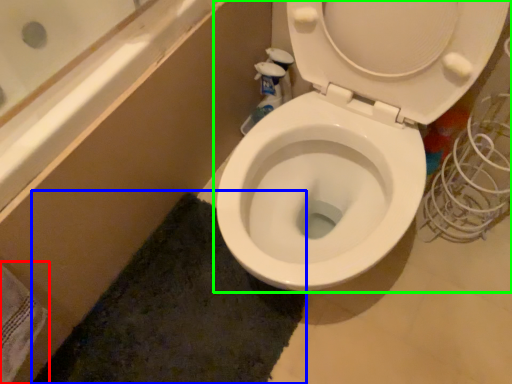
Question: Which object is the closest to the bath towel (highlighted by a red box)? Choose among these: bath mat (highlighted by a blue box) or toilet (highlighted by a green box).

Choices:
 (A) bath mat
 (B) toilet

Answer: (A)